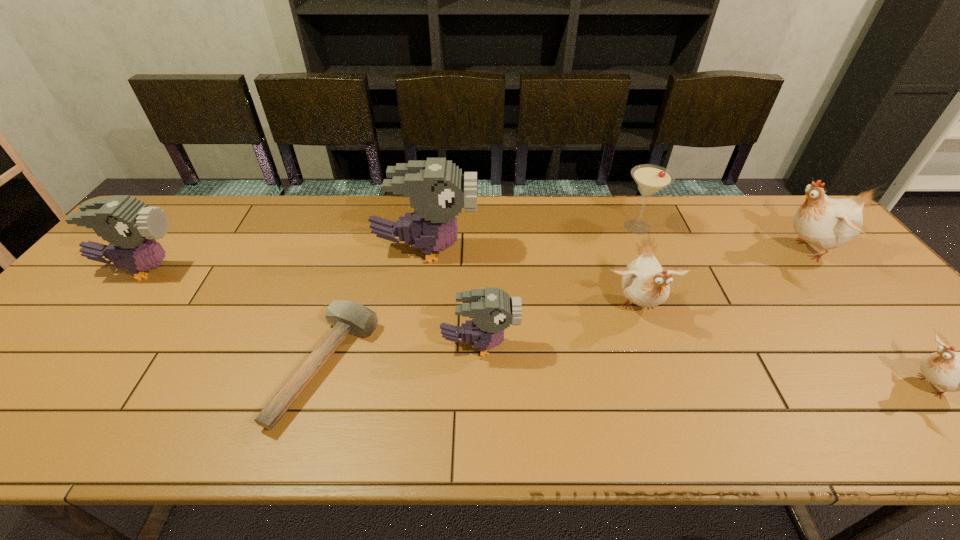
The height and width of the screenshot is (540, 960). Find the location of `free space between the smallest gray bird and the leftmost gray bird`. free space between the smallest gray bird and the leftmost gray bird is located at coordinates (311, 307).

The height and width of the screenshot is (540, 960). I want to click on vacant area between the leftmost white bird and the biggest gray bird, so click(x=533, y=279).

Locate an element on the screen. The width and height of the screenshot is (960, 540). vacant area that lies between the biggest gray bird and the shortest object is located at coordinates (376, 308).

Identify which object is the fifth nearest to the leftmost gray bird. Please provide its 2D coordinates. Your answer should be formatted as a tuple, i.e. [(x, y)], where the tuple contains the x and y coordinates of a point satisfying the conditions above.

[(650, 179)]

Select which object is the third closest to the biggest white bird. Please provide its 2D coordinates. Your answer should be formatted as a tuple, i.e. [(x, y)], where the tuple contains the x and y coordinates of a point satisfying the conditions above.

[(645, 283)]

Identify which bird is the closest to the mallet. Please provide its 2D coordinates. Your answer should be formatted as a tuple, i.e. [(x, y)], where the tuple contains the x and y coordinates of a point satisfying the conditions above.

[(493, 310)]

Locate an element on the screen. Image resolution: width=960 pixels, height=540 pixels. bird that stands as the second closest to the third bird from right to left is located at coordinates point(437,189).

Identify which gray bird is located as the nearest to the biggest gray bird. Please provide its 2D coordinates. Your answer should be formatted as a tuple, i.e. [(x, y)], where the tuple contains the x and y coordinates of a point satisfying the conditions above.

[(493, 310)]

Locate an element on the screen. gray bird that stands as the third closest to the biggest white bird is located at coordinates (130, 226).

This screenshot has width=960, height=540. What are the coordinates of `the closest white bird to the biggest white bird` in the screenshot? It's located at (951, 371).